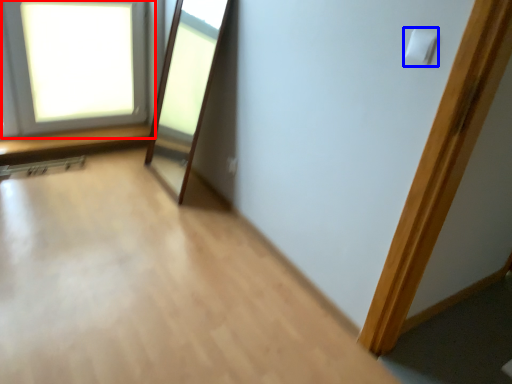
Question: Which point is closer to the camera, window (highlighted by a red box) or light switch (highlighted by a blue box)?

Choices:
 (A) window
 (B) light switch

Answer: (B)